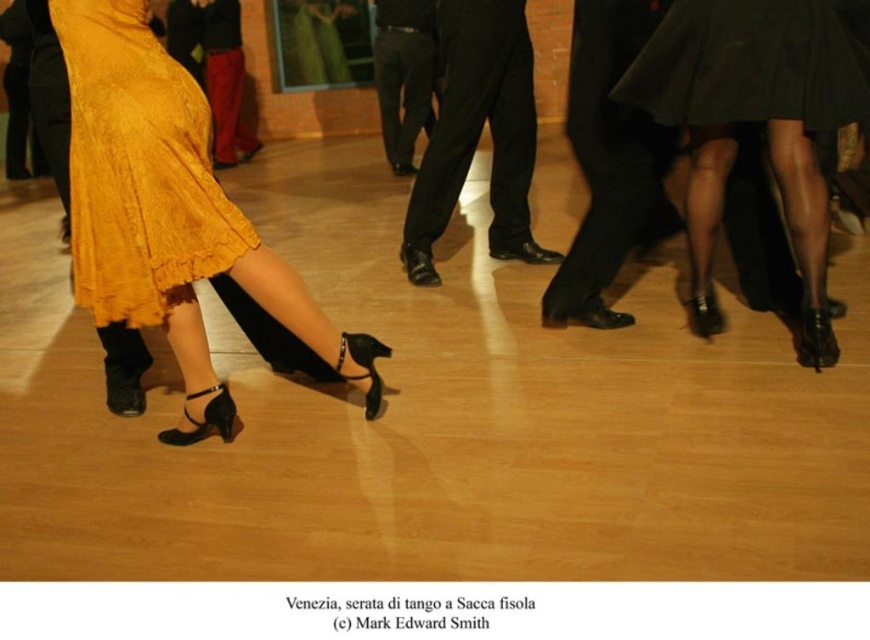
Can you confirm if matte yellow dress at left is positioned below black leather pants at center?

Yes, matte yellow dress at left is below black leather pants at center.

Does matte yellow dress at left appear on the right side of black leather pants at center?

Incorrect, matte yellow dress at left is not on the right side of black leather pants at center.

Does point (246, 220) come farther from viewer compared to point (440, 52)?

No.

Where is `matte yellow dress at left`? Image resolution: width=870 pixels, height=640 pixels. matte yellow dress at left is located at coordinates (171, 212).

Can you confirm if matte yellow dress at left is positioned below mustard yellow fabric skirt at lower left?

Correct, matte yellow dress at left is located below mustard yellow fabric skirt at lower left.

Locate an element on the screen. This screenshot has width=870, height=640. matte yellow dress at left is located at coordinates (171, 212).

Does point (79, 252) come closer to viewer compared to point (198, 100)?

No.

In order to click on matte yellow dress at left in this screenshot , I will do `click(171, 212)`.

Between shiny black skirt at upper right and black leather pants at center, which one appears on the left side from the viewer's perspective?

black leather pants at center is more to the left.

Who is more distant from viewer, (687, 104) or (527, 72)?

Point (527, 72)

The height and width of the screenshot is (640, 870). Identify the location of shiny black skirt at upper right. (754, 122).